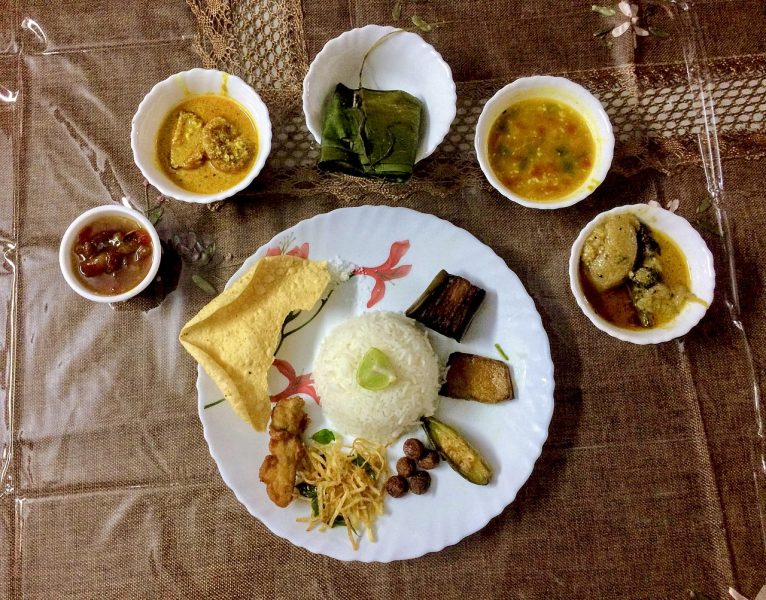
What are the coordinates of `small bowl` in the screenshot? It's located at (155, 240).